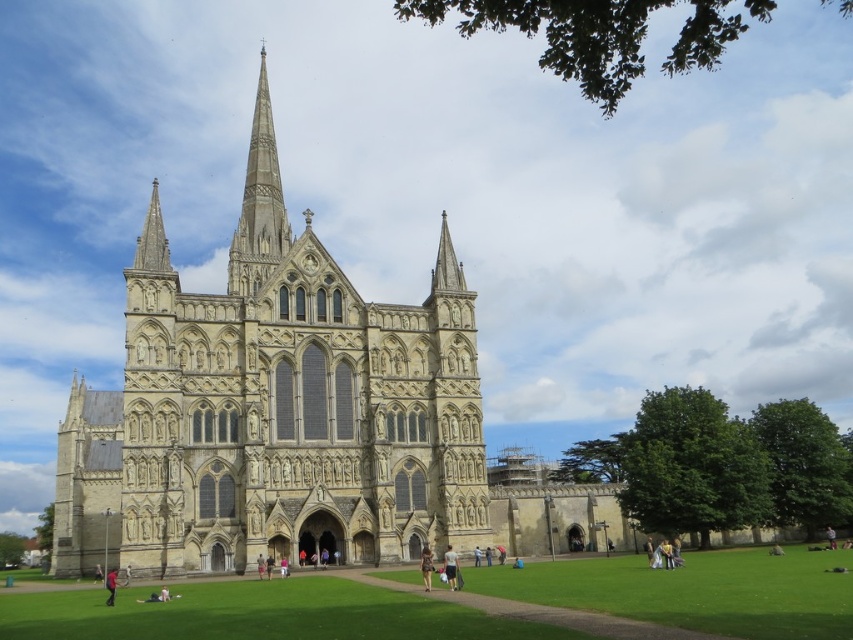
You are standing in a park and see the beige stone church at center. If you want to reach the church, how many steps would you estimate you need to take?

The beige stone church at center is 51.81 meters away from viewer. Assuming an average step length of about 0.76 meters, you would need approximately 68 steps to reach the church.

You are standing in front of the Gothic cathedral and want to place a small potted plant exactly where the light brown fabric bag at center is currently positioned. Is this location on the lawn or near the cathedral steps?

The light brown fabric bag at center is located at point coordinates that are on the lawn area, so placing the potted plant there would be appropriate as the lawn is maintained for such decor.